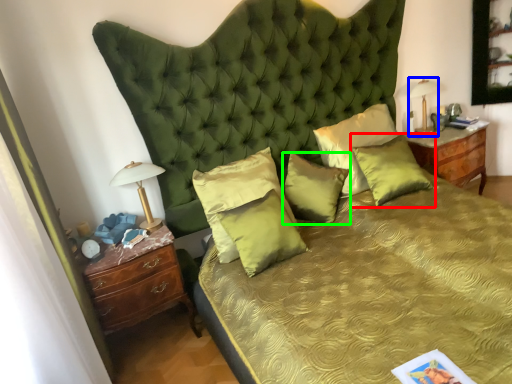
Question: Which object is positioned closest to pillow (highlighted by a red box)? Select from bedside lamp (highlighted by a blue box) and pillow (highlighted by a green box).

Choices:
 (A) bedside lamp
 (B) pillow

Answer: (B)